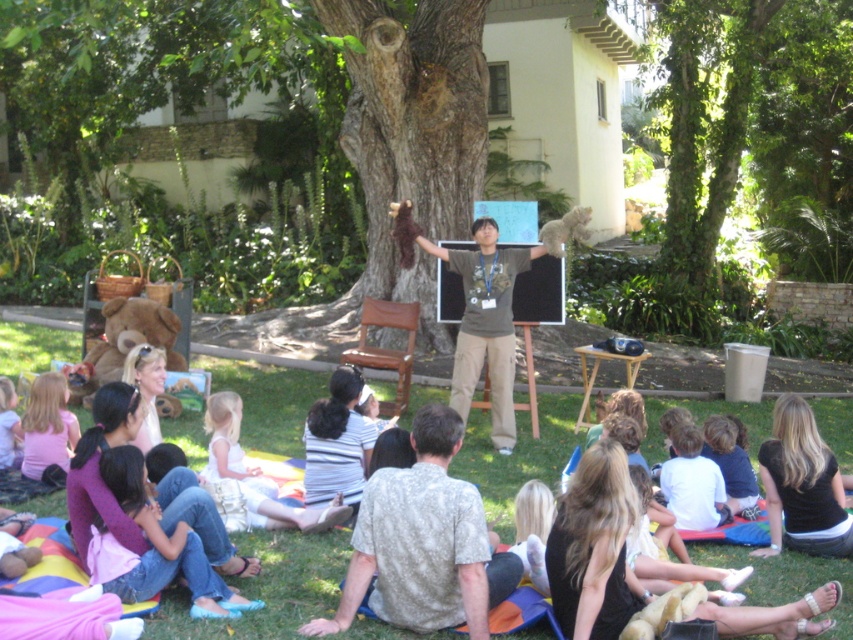
Question: Can you confirm if brown rough tree at center is positioned to the left of white cotton dress at center?

Choices:
 (A) yes
 (B) no

Answer: (A)

Question: Does light brown textured shirt at center appear under light pink fabric at lower left?

Choices:
 (A) yes
 (B) no

Answer: (A)

Question: Estimate the real-world distances between objects in this image. Which object is farther from the brown rough tree at center?

Choices:
 (A) green grass at center
 (B) white cotton dress at center

Answer: (B)

Question: Which of the following is the closest to the observer?

Choices:
 (A) light brown textured shirt at center
 (B) brown rough tree at center

Answer: (A)

Question: Is green grass at center to the left of white cotton dress at center from the viewer's perspective?

Choices:
 (A) no
 (B) yes

Answer: (A)

Question: Which of the following is the closest to the observer?

Choices:
 (A) (4, 465)
 (B) (231, 449)

Answer: (B)